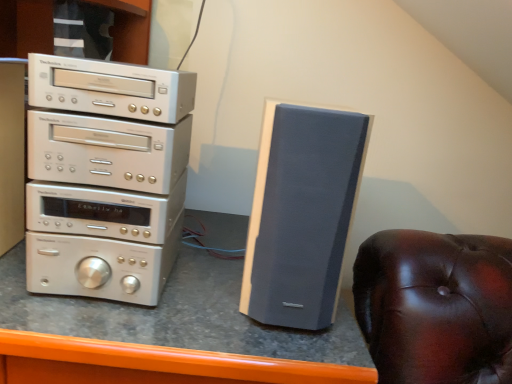
The width and height of the screenshot is (512, 384). I want to click on vacant space that is in between silver metallic stereo stack at left and matte gray speaker at right, so click(x=201, y=289).